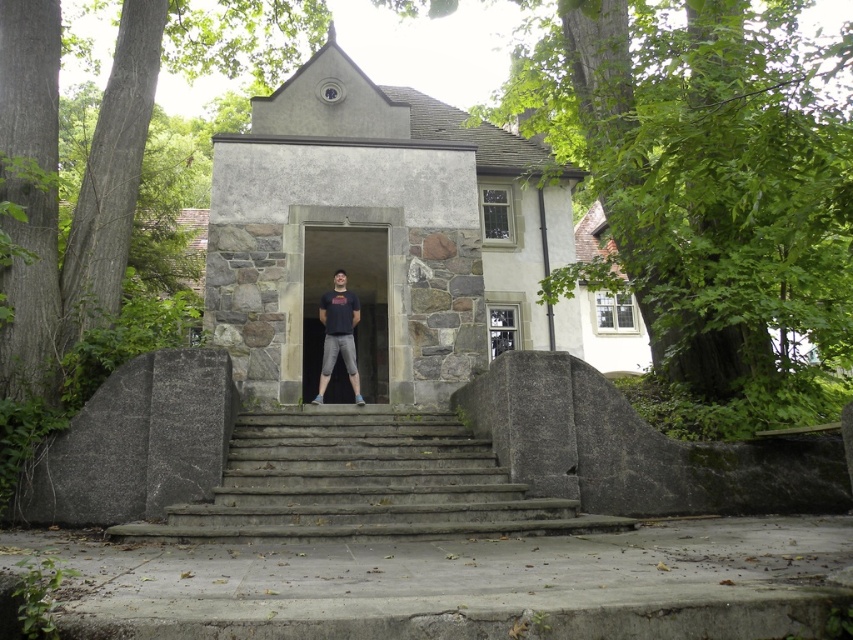
Does stone door at center appear over dark blue t-shirt at center?

No.

Between point (376, 332) and point (335, 339), which one is positioned in front?

Point (335, 339) is more forward.

Locate an element on the screen. This screenshot has width=853, height=640. stone door at center is located at coordinates (357, 296).

Can you confirm if gray concrete stairs at center is positioned to the left of dark blue t-shirt at center?

Incorrect, gray concrete stairs at center is not on the left side of dark blue t-shirt at center.

Does gray concrete stairs at center come in front of dark blue t-shirt at center?

Yes, gray concrete stairs at center is closer to the viewer.

Between point (328, 467) and point (326, 362), which one is positioned in front?

Point (328, 467)

Locate an element on the screen. gray concrete stairs at center is located at coordinates (363, 483).

Does stone gray chapel at center have a greater width compared to gray concrete stairs at center?

Yes.

Is point (368, 300) positioned in front of point (361, 509)?

No, (368, 300) is further to viewer.

Where is `stone gray chapel at center`? The image size is (853, 640). stone gray chapel at center is located at coordinates (375, 236).